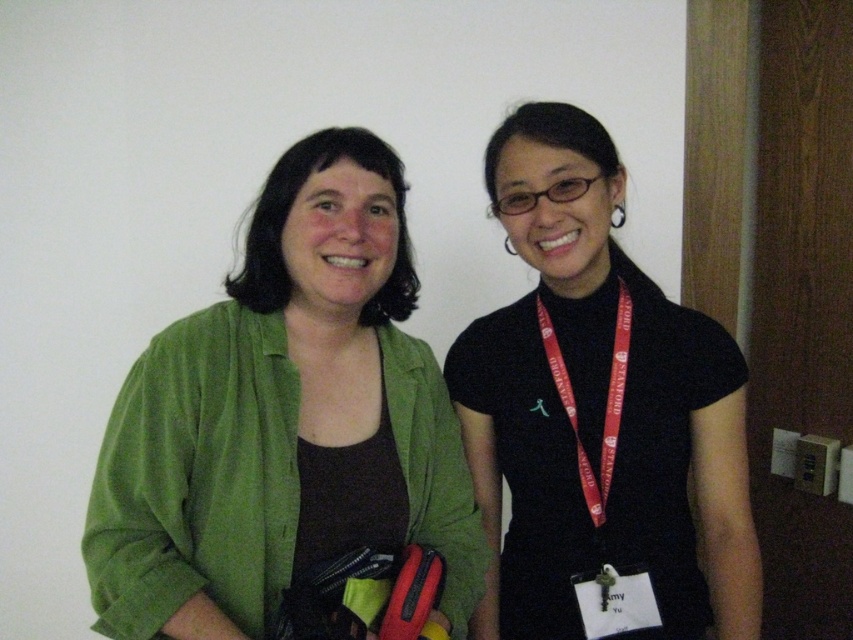
You are a photographer standing 1.5 meters away from the camera. You want to take a photo of the green cotton shirt at center. Can you reach it without moving the camera?

The green cotton shirt at center is 1.03 meters from camera, so yes, you can reach it without moving the camera since you are standing 1.5 meters away, which is farther than the distance to the shirt.

Based on the scene description, where is the green cotton shirt at center located in terms of coordinates?

The green cotton shirt at center is located at coordinates point (281, 428).

You are standing in front of the two people in the image. You want to place a small sticker on the point that is closer to you. Which point should you choose between point (x=383, y=432) and point (x=727, y=390)?

Point (x=383, y=432) is closer to the viewer than point (x=727, y=390), so you should place the sticker on point (x=383, y=432).